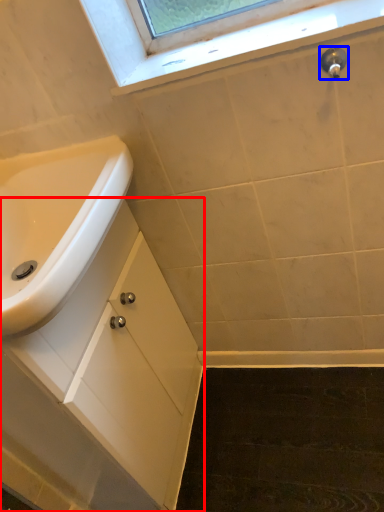
Question: Which of the following is the closest to the observer, bathroom cabinet (highlighted by a red box) or plumbing fixture (highlighted by a blue box)?

Choices:
 (A) bathroom cabinet
 (B) plumbing fixture

Answer: (A)